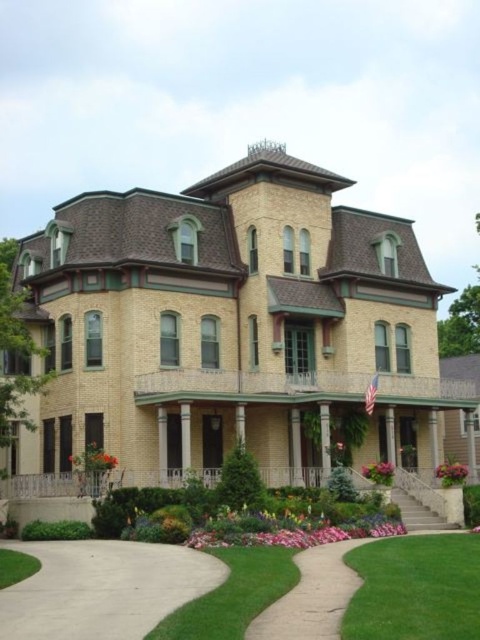
Question: Does pink fabric flower at lower right have a larger size compared to pink matte flower at center?

Choices:
 (A) no
 (B) yes

Answer: (B)

Question: Is green grass lawn at lower right closer to the viewer compared to concrete at center?

Choices:
 (A) yes
 (B) no

Answer: (A)

Question: Which object is the closest to the pink fabric flower at lower right?

Choices:
 (A) pink matte flower at center
 (B) pink matte flower at lower right
 (C) light beige concrete driveway at lower center

Answer: (B)

Question: Which of these objects is positioned closest to the pink fabric flower at lower right?

Choices:
 (A) pink matte flower at center
 (B) pink matte flower at lower right
 (C) concrete at center
 (D) green grass lawn at lower right

Answer: (B)

Question: Which point appears closest to the camera in this image?

Choices:
 (A) (276, 630)
 (B) (99, 609)
 (C) (405, 552)

Answer: (A)

Question: Does light beige concrete driveway at lower center appear on the right side of green grass lawn at lower right?

Choices:
 (A) no
 (B) yes

Answer: (A)